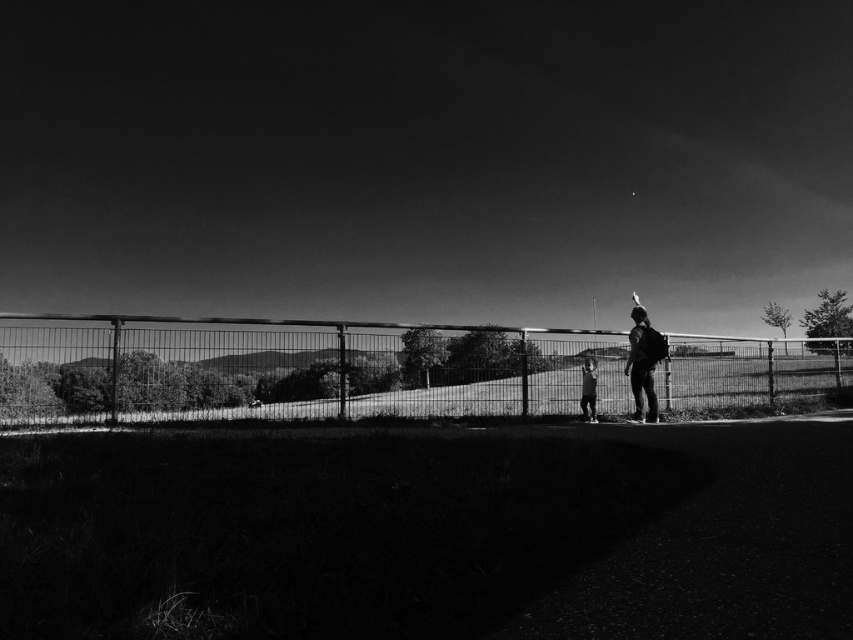
Who is positioned more to the right, metallic fence at center or shiny black skateboard at center?

Positioned to the right is shiny black skateboard at center.

What are the coordinates of `metallic fence at center` in the screenshot? It's located at (426, 157).

Is point (544, 96) less distant than point (647, 352)?

No.

The height and width of the screenshot is (640, 853). Find the location of `metallic fence at center`. metallic fence at center is located at coordinates (426, 157).

Does point (412, 381) come in front of point (584, 358)?

No, (412, 381) is behind (584, 358).

Does metallic wire fence at center appear on the right side of smooth skin child at center?

In fact, metallic wire fence at center is to the left of smooth skin child at center.

Where is `metallic wire fence at center`? metallic wire fence at center is located at coordinates (293, 371).

Which of these two, metallic fence at center or metallic wire fence at center, stands shorter?

With less height is metallic wire fence at center.

Is metallic fence at center above metallic wire fence at center?

Yes, metallic fence at center is above metallic wire fence at center.

Is point (776, 173) in front of point (78, 358)?

No, it is behind (78, 358).

Where is `metallic fence at center`? The height and width of the screenshot is (640, 853). metallic fence at center is located at coordinates (426, 157).